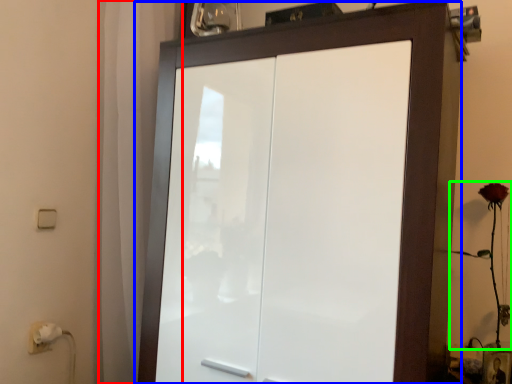
Question: Which object is the farthest from curtain (highlighted by a red box)? Choose among these: cupboard (highlighted by a blue box) or flower (highlighted by a green box).

Choices:
 (A) cupboard
 (B) flower

Answer: (B)